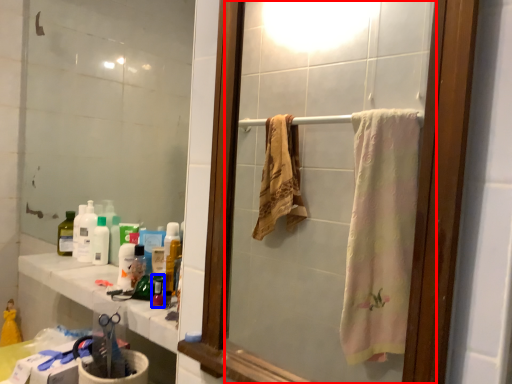
Question: Which object appears farthest to the camera in this image, mirror (highlighted by a red box) or mouthwash (highlighted by a blue box)?

Choices:
 (A) mirror
 (B) mouthwash

Answer: (B)